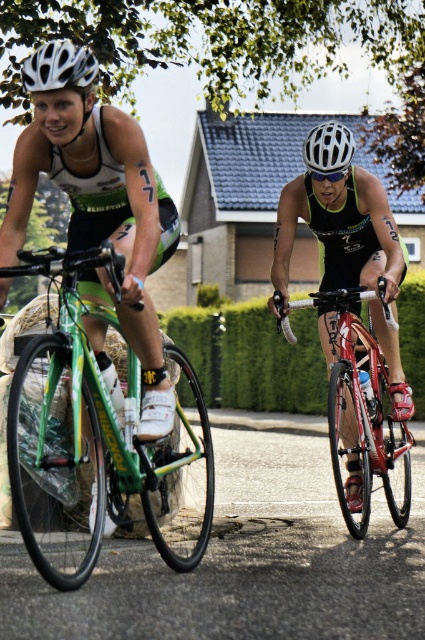
You are a photographer positioned at the center of the image. You need to capture a closeup of the white matte bicycle helmet at upper left without moving your camera. Can you do it based on its position?

The white matte bicycle helmet at upper left is located at point [59,67], which is within the frame of the image, so yes, you can capture a closeup of the white matte bicycle helmet at upper left without moving your camera.